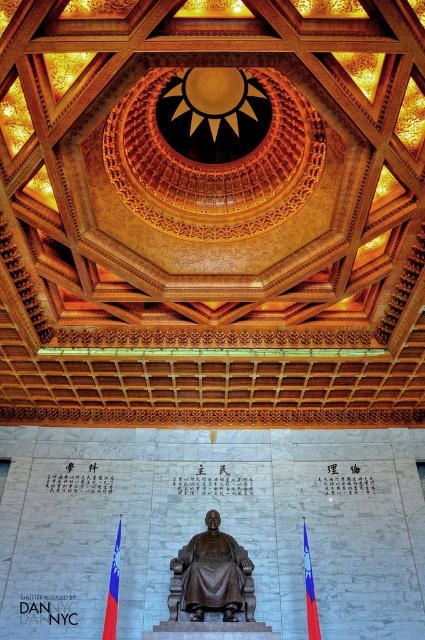
From the picture: You are standing in the ornate interior space and want to place a new decorative item between the bronze statue at center and the red fabric flag at lower left. Based on their positions, where should you place the new item?

Since the bronze statue at center is to the right of the red fabric flag at lower left, you should place the new decorative item between them, positioning it to the right of the red fabric flag at lower left and to the left of the bronze statue at center.